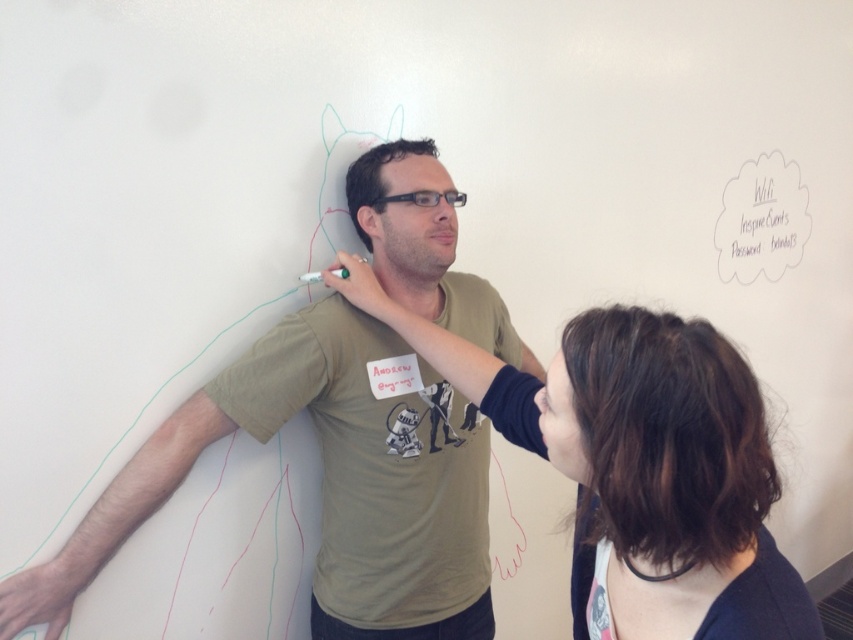
Describe the element at coordinates (323, 486) in the screenshot. I see `matte khaki t-shirt at center` at that location.

Is matte khaki t-shirt at center closer to camera compared to dark brown hair at upper right?

No, matte khaki t-shirt at center is behind dark brown hair at upper right.

Between point (421, 460) and point (437, 356), which one is positioned behind?

Point (421, 460)

Locate an element on the screen. matte khaki t-shirt at center is located at coordinates (323, 486).